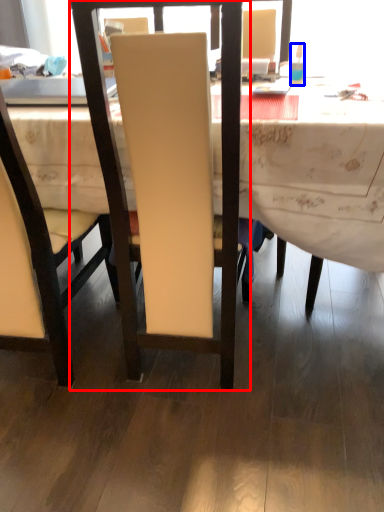
Question: Among these objects, which one is nearest to the camera, chair (highlighted by a red box) or bottle (highlighted by a blue box)?

Choices:
 (A) chair
 (B) bottle

Answer: (A)